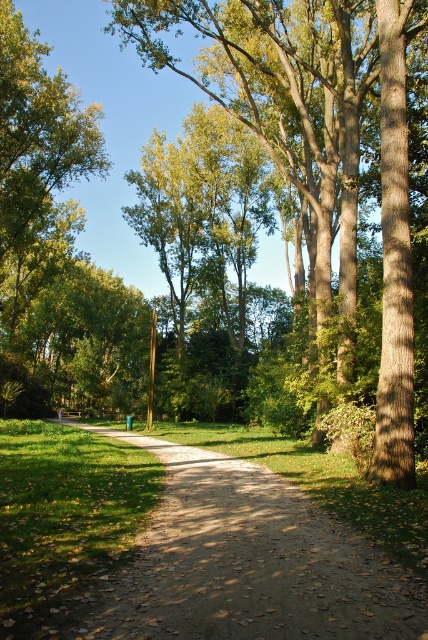
You are standing at the starting point of the winding dirt path in the park. You see two points marked on the path ahead of you. The first point is at coordinates point (386, 467) and the second point is at point (249, 540). Which point is closer to your current position?

Point (249, 540) is closer to your current position because it is less further to the camera than point (386, 467).